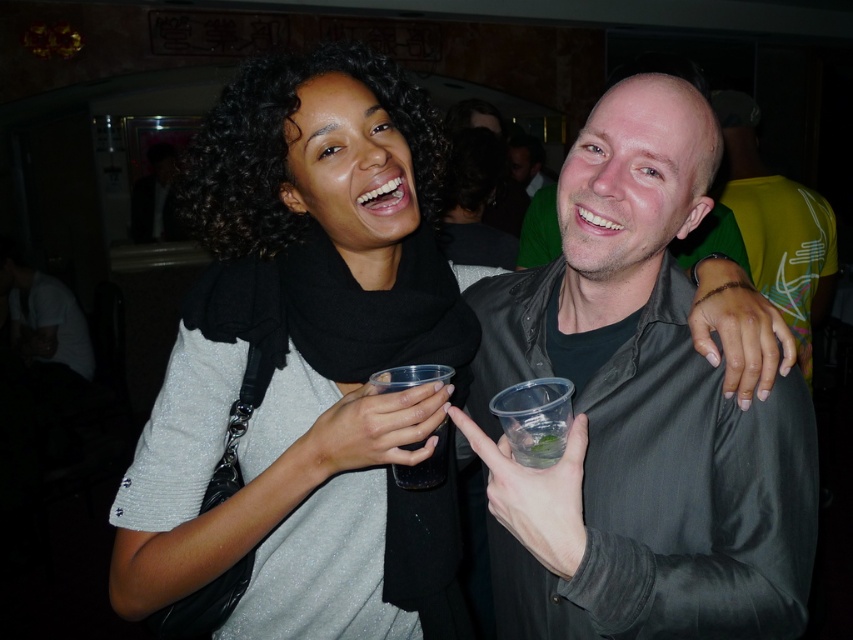
Question: Is green matte shirt at right to the left of clear plastic cup at center from the viewer's perspective?

Choices:
 (A) yes
 (B) no

Answer: (B)

Question: In this image, where is green matte shirt at right located relative to translucent plastic cup at center?

Choices:
 (A) right
 (B) left

Answer: (A)

Question: Where is matte black scarf at center located in relation to matte gray shirt at center in the image?

Choices:
 (A) right
 (B) left

Answer: (B)

Question: Which is farther from the matte gray shirt at center?

Choices:
 (A) translucent plastic cup at center
 (B) green matte shirt at right

Answer: (B)

Question: Which object appears closest to the camera in this image?

Choices:
 (A) translucent plastic cup at center
 (B) matte black scarf at center
 (C) green matte shirt at right

Answer: (B)

Question: Among these objects, which one is farthest from the camera?

Choices:
 (A) matte gray shirt at center
 (B) clear plastic cup at center
 (C) matte black scarf at center
 (D) green matte shirt at right

Answer: (D)